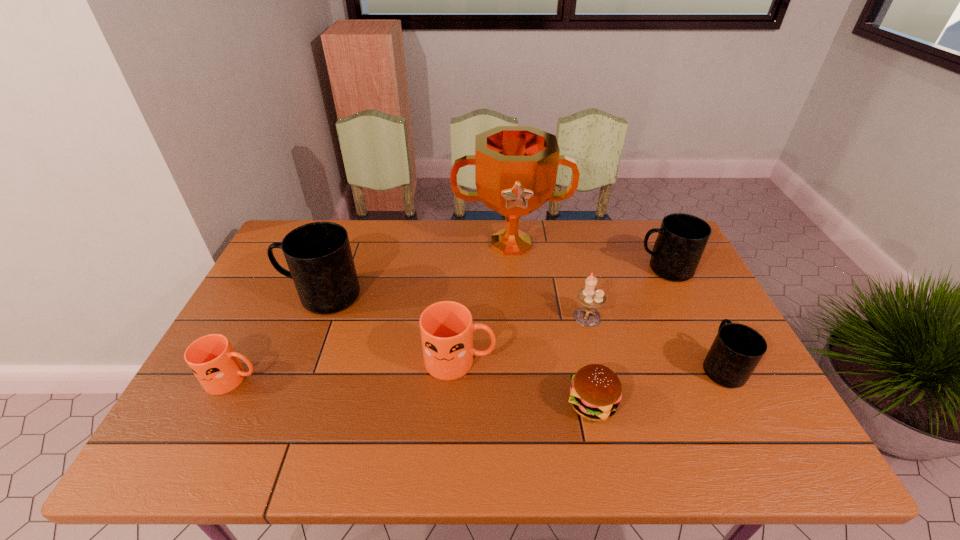
Locate an element on the screen. The image size is (960, 540). hamburger is located at coordinates (596, 391).

Where is `free space located on the side of the gold award with the star emblem`? The height and width of the screenshot is (540, 960). free space located on the side of the gold award with the star emblem is located at coordinates (517, 320).

You are a GUI agent. You are given a task and a screenshot of the screen. Output one action in this format:
    pyautogui.click(x=<x>, y=<y>)
    Task: Click on the free region located on the side of the leftmost black mug with the handle
    This screenshot has height=540, width=960.
    Given the screenshot: What is the action you would take?
    pyautogui.click(x=267, y=296)

This screenshot has height=540, width=960. I want to click on vacant space situated on the side of the second biggest black mug with the handle, so click(573, 269).

The width and height of the screenshot is (960, 540). In order to click on vacant space located 0.170m on the side of the second biggest black mug with the handle in this screenshot , I will do `click(582, 269)`.

Find the location of a particular element. The image size is (960, 540). vacant region located on the side of the second biggest black mug with the handle is located at coordinates (551, 269).

I want to click on vacant space situated on the right of the candle holder, so click(636, 317).

Find the location of a particular element. This screenshot has height=540, width=960. vacant space located 0.350m on the handle side of the third mug from left to right is located at coordinates (633, 361).

Image resolution: width=960 pixels, height=540 pixels. Identify the location of free point located 0.060m on the side of the smallest black mug with the handle. (702, 329).

The image size is (960, 540). What are the coordinates of `free space located 0.190m on the side of the smallest black mug with the handle` in the screenshot? It's located at (685, 296).